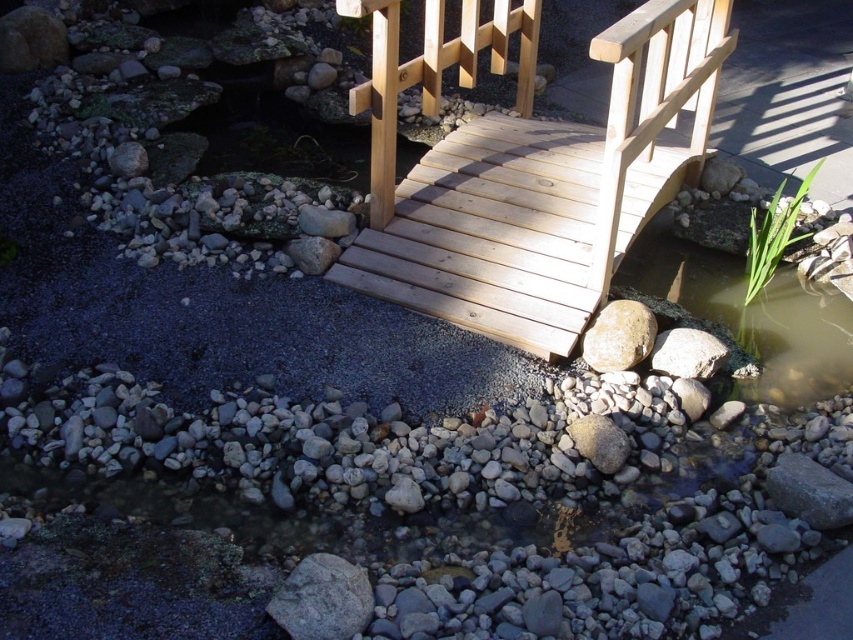
Is green mossy rock at lower right taller than gray rough rock at center?

Correct, green mossy rock at lower right is much taller as gray rough rock at center.

Is point (787, 312) closer to camera compared to point (335, 608)?

No, (787, 312) is behind (335, 608).

Image resolution: width=853 pixels, height=640 pixels. I want to click on green mossy rock at lower right, so click(751, 314).

Which is more to the left, green mossy rock at lower right or smooth gray rock at center-right?

From the viewer's perspective, smooth gray rock at center-right appears more on the left side.

Is green mossy rock at lower right wider than smooth gray rock at center-right?

Yes.

The width and height of the screenshot is (853, 640). Find the location of `green mossy rock at lower right`. green mossy rock at lower right is located at coordinates (751, 314).

Based on the photo, which of these two, smooth gray rock at center-right or gray rough rock at lower right, stands shorter?

With less height is gray rough rock at lower right.

Is smooth gray rock at center-right to the left of gray rough rock at lower right from the viewer's perspective?

Yes, smooth gray rock at center-right is to the left of gray rough rock at lower right.

What do you see at coordinates (618, 336) in the screenshot? I see `smooth gray rock at center-right` at bounding box center [618, 336].

You are a GUI agent. You are given a task and a screenshot of the screen. Output one action in this format:
    pyautogui.click(x=<x>, y=<y>)
    Task: Click on the smooth gray rock at center-right
    This screenshot has width=853, height=640.
    Given the screenshot: What is the action you would take?
    pyautogui.click(x=618, y=336)